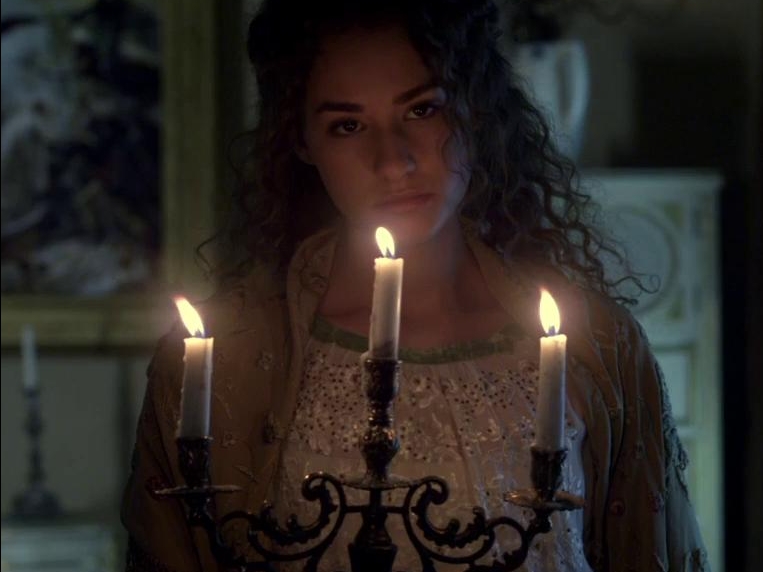
Identify the location of candle. (391, 315).